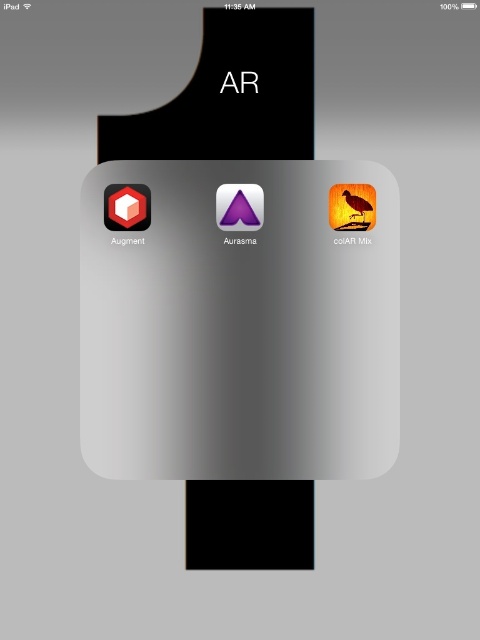
Question: Is matte orange bird at center below matte black cube at center?

Choices:
 (A) yes
 (B) no

Answer: (B)

Question: Does orange glossy bird at center have a lesser width compared to matte purple triangle at center?

Choices:
 (A) yes
 (B) no

Answer: (B)

Question: Among these objects, which one is nearest to the camera?

Choices:
 (A) matte red cube at center
 (B) matte purple triangle at center
 (C) matte black cube at center

Answer: (A)

Question: Which point is closer to the camera taking this photo?

Choices:
 (A) (237, 198)
 (B) (120, 244)
 (C) (343, 243)
 (D) (247, 243)

Answer: (A)

Question: Which point is farther to the camera?

Choices:
 (A) matte black cube at center
 (B) orange glossy bird at center
 (C) purple glossy triangle at center

Answer: (B)

Question: Is purple glossy triangle at center wider than orange glossy bird at center?

Choices:
 (A) yes
 (B) no

Answer: (A)